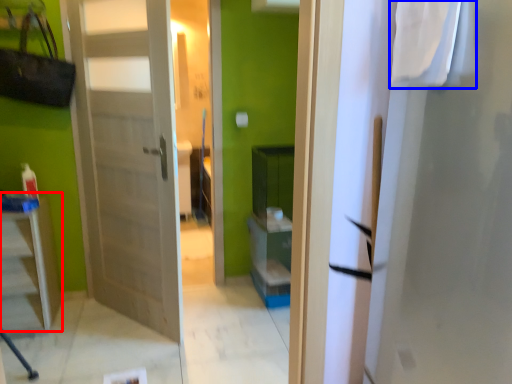
Question: Which of the following is the farthest to the observer, furniture (highlighted by a red box) or laundry (highlighted by a blue box)?

Choices:
 (A) furniture
 (B) laundry

Answer: (A)